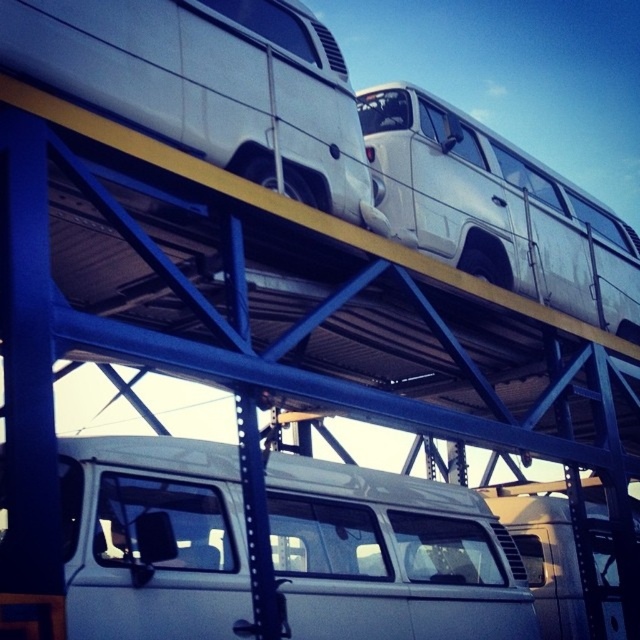
Does point (68, 554) come closer to viewer compared to point (566, 195)?

Yes, it is.

Does white matte van at center appear on the left side of white metallic van at upper center?

Correct, you'll find white matte van at center to the left of white metallic van at upper center.

Which is behind, point (147, 554) or point (417, 163)?

The point (417, 163) is more distant.

Locate an element on the screen. white matte van at center is located at coordinates (390, 556).

Is white matte van at upper center to the left of white metallic van at upper center from the viewer's perspective?

Indeed, white matte van at upper center is positioned on the left side of white metallic van at upper center.

How far apart are white matte van at upper center and white metallic van at upper center?

A distance of 7.79 meters exists between white matte van at upper center and white metallic van at upper center.

I want to click on white matte van at upper center, so click(x=209, y=84).

Does point (486, 515) come in front of point (44, 81)?

No, it is behind (44, 81).

Does white matte van at center have a smaller size compared to white matte van at upper center?

Correct, white matte van at center occupies less space than white matte van at upper center.

You are a GUI agent. You are given a task and a screenshot of the screen. Output one action in this format:
    pyautogui.click(x=<x>, y=<y>)
    Task: Click on the white matte van at center
    The image size is (640, 640).
    Given the screenshot: What is the action you would take?
    pyautogui.click(x=390, y=556)